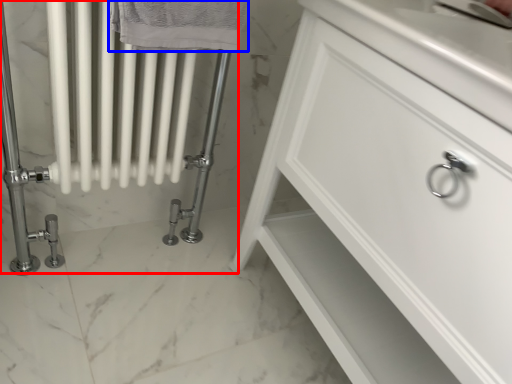
Question: Which object is closer to the camera taking this photo, bath (highlighted by a red box) or bath towel (highlighted by a blue box)?

Choices:
 (A) bath
 (B) bath towel

Answer: (B)